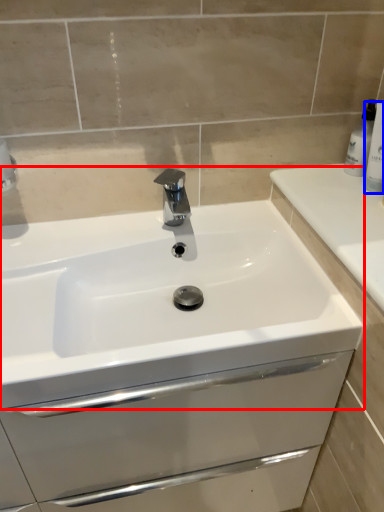
Question: Among these objects, which one is farthest to the camera, sink (highlighted by a red box) or toiletry (highlighted by a blue box)?

Choices:
 (A) sink
 (B) toiletry

Answer: (B)